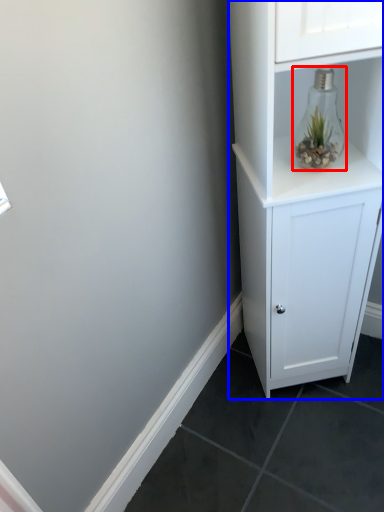
Question: Which object is closer to the camera taking this photo, glass vase (highlighted by a red box) or cupboard (highlighted by a blue box)?

Choices:
 (A) glass vase
 (B) cupboard

Answer: (B)